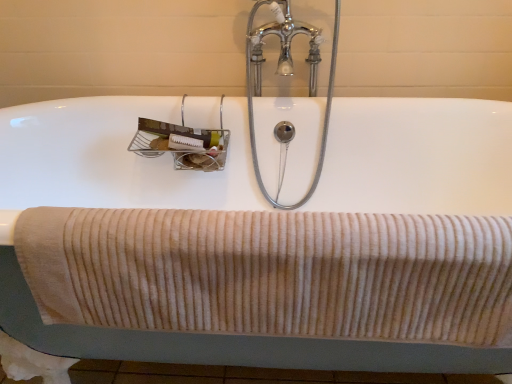
Where is `empty space that is ontop of beige corduroy towel at lower center`? empty space that is ontop of beige corduroy towel at lower center is located at coordinates (294, 221).